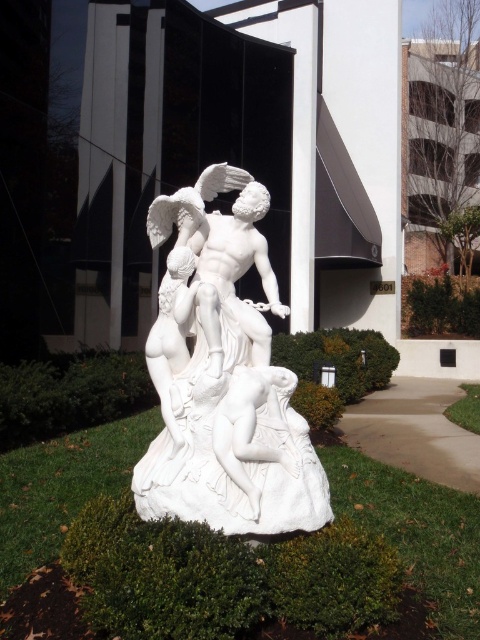
Is white marble sculpture at center wider than white marble nude at lower center?

Yes, white marble sculpture at center is wider than white marble nude at lower center.

Looking at this image, does white marble sculpture at center come behind white marble nude at lower center?

Yes, it is behind white marble nude at lower center.

Which is behind, point (171, 304) or point (256, 380)?

The point (171, 304) is behind.

Locate an element on the screen. The height and width of the screenshot is (640, 480). white marble sculpture at center is located at coordinates (223, 378).